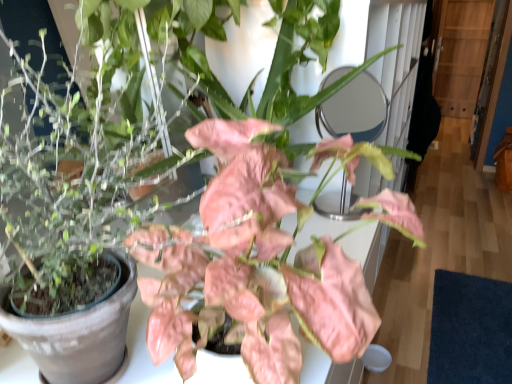
Where is `pink matte leafy plant at center`? pink matte leafy plant at center is located at coordinates (250, 268).

Describe the element at coordinates (250, 268) in the screenshot. The height and width of the screenshot is (384, 512). I see `pink matte leafy plant at center` at that location.

Measure the distance between point (259, 223) and camera.

13.43 inches.

Locate an element on the screen. This screenshot has width=512, height=384. pink matte leafy plant at center is located at coordinates (250, 268).